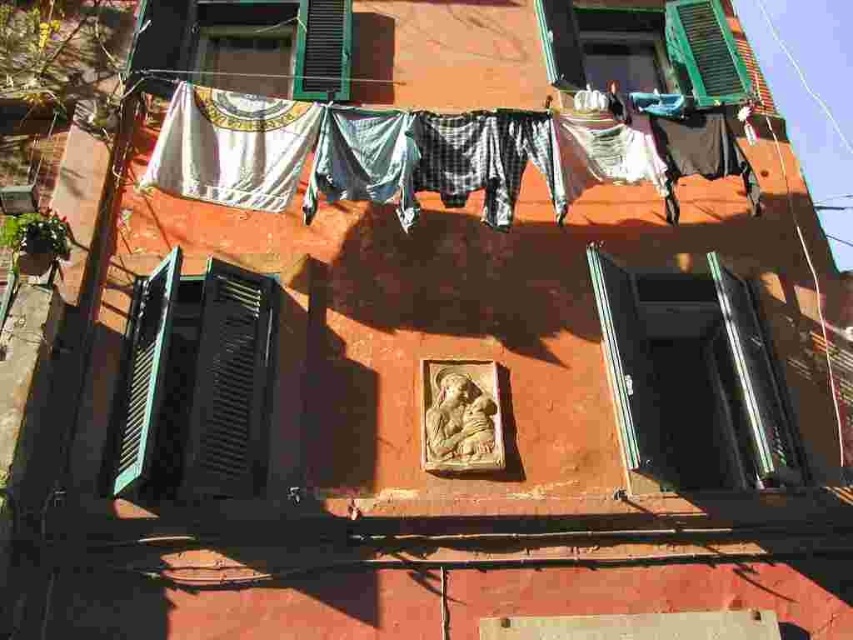
Question: From the image, what is the correct spatial relationship of green matte window at left in relation to green matte shutter at upper right?

Choices:
 (A) below
 (B) above

Answer: (A)

Question: Which of these objects is positioned farthest from the metallic silver window at center?

Choices:
 (A) green matte shutter at upper center
 (B) white fabric at upper center
 (C) green matte shutter at upper right

Answer: (A)

Question: Can you confirm if white fabric at upper center is positioned to the left of green matte shutter at upper center?

Choices:
 (A) no
 (B) yes

Answer: (A)

Question: Considering the real-world distances, which object is closest to the green matte window at left?

Choices:
 (A) green matte shutter at upper center
 (B) metallic silver window at center
 (C) green matte shutter at upper right
 (D) white fabric at upper center

Answer: (D)

Question: Can you confirm if green matte window at left is positioned to the right of green matte shutter at upper center?

Choices:
 (A) no
 (B) yes

Answer: (A)

Question: Which object is closer to the camera taking this photo?

Choices:
 (A) white fabric at upper center
 (B) green matte shutter at upper right

Answer: (A)